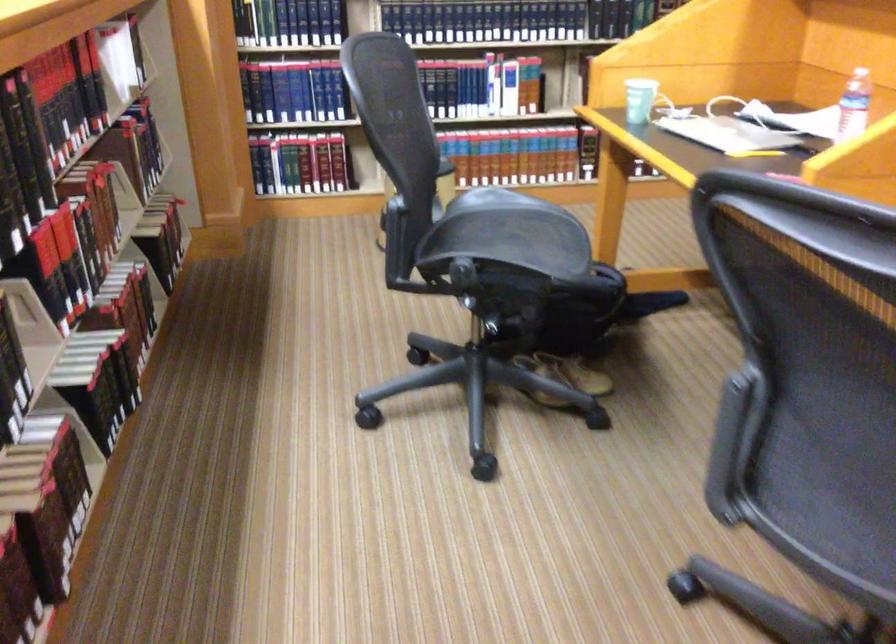
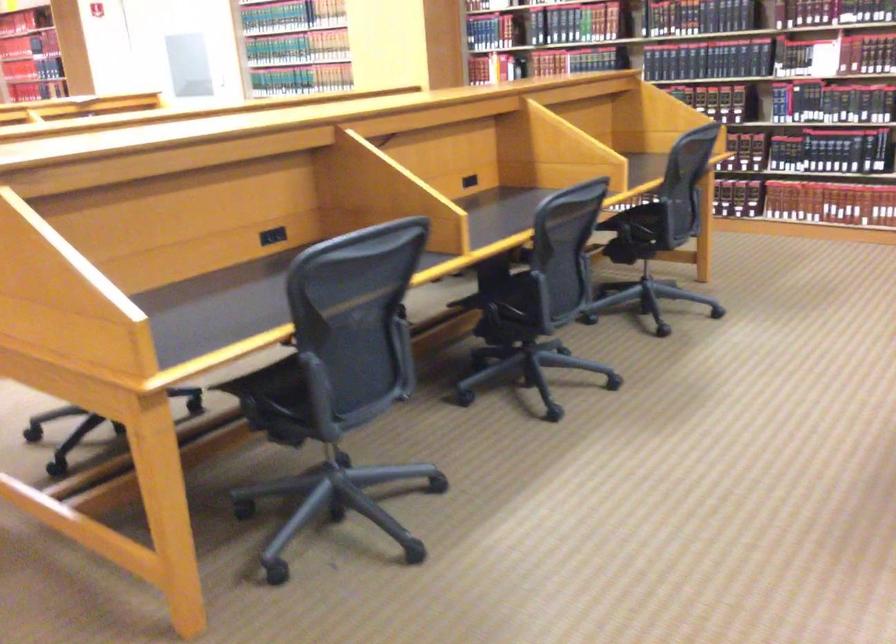
Question: I am providing you with two images of the same scene from different viewpoints. Which of the following objects are not visible in image2?

Choices:
 (A) chair sitting surface
 (B) black power outlet
 (C) paper cup
 (D) small pull bell

Answer: (C)